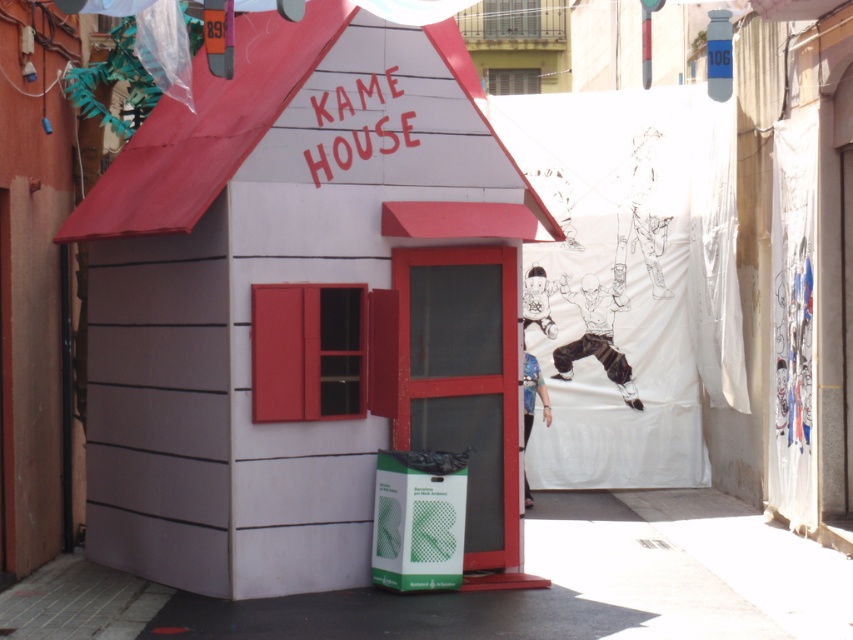
Question: Is matte white house at center positioned in front of white matte hut at center?

Choices:
 (A) yes
 (B) no

Answer: (A)

Question: Is the position of matte white house at center less distant than that of white matte hut at center?

Choices:
 (A) no
 (B) yes

Answer: (B)

Question: Which point is farther to the camera?

Choices:
 (A) (39, 253)
 (B) (300, 509)

Answer: (A)

Question: Which point is farther to the camera?

Choices:
 (A) white matte hut at center
 (B) matte white house at center

Answer: (A)

Question: Which object appears farthest from the camera in this image?

Choices:
 (A) white matte hut at center
 (B) matte white house at center

Answer: (A)

Question: Can you confirm if matte white house at center is positioned to the left of white matte hut at center?

Choices:
 (A) yes
 (B) no

Answer: (B)